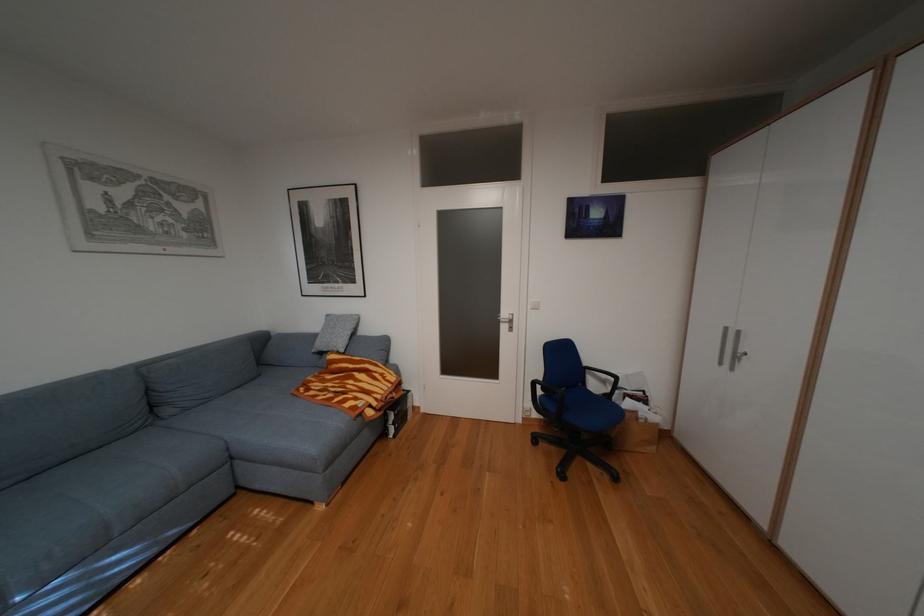
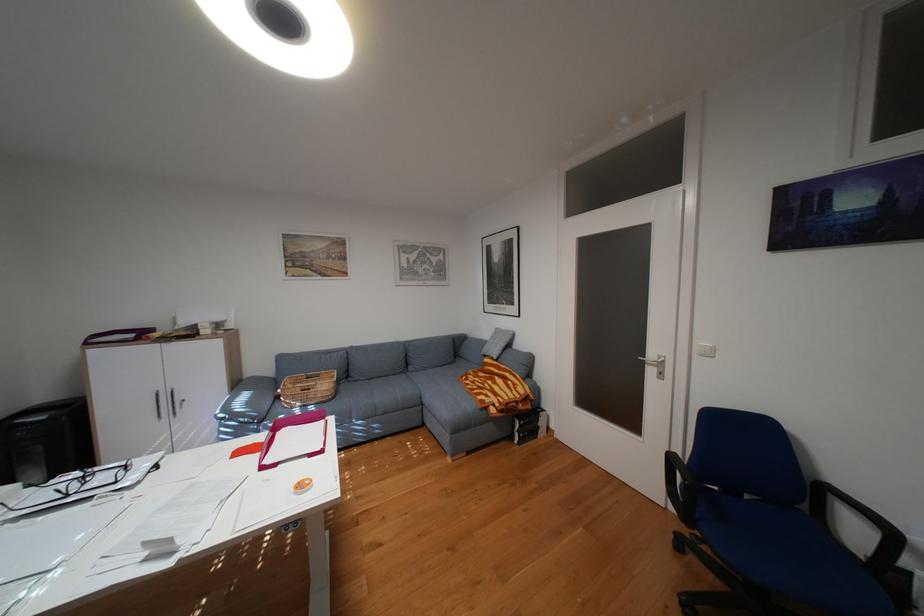
Where in the second image is the point corresponding to point 199,408 from the first image?

(430, 370)